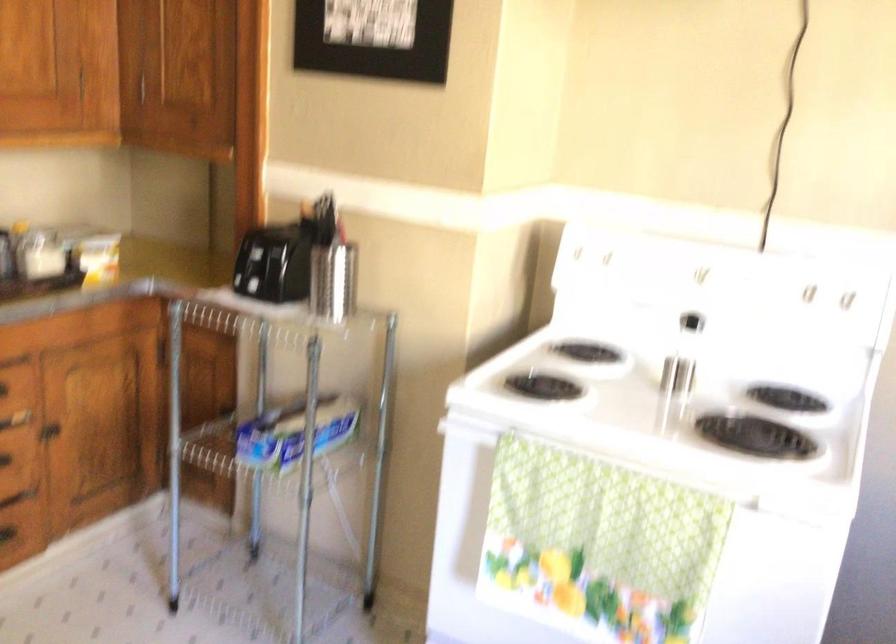
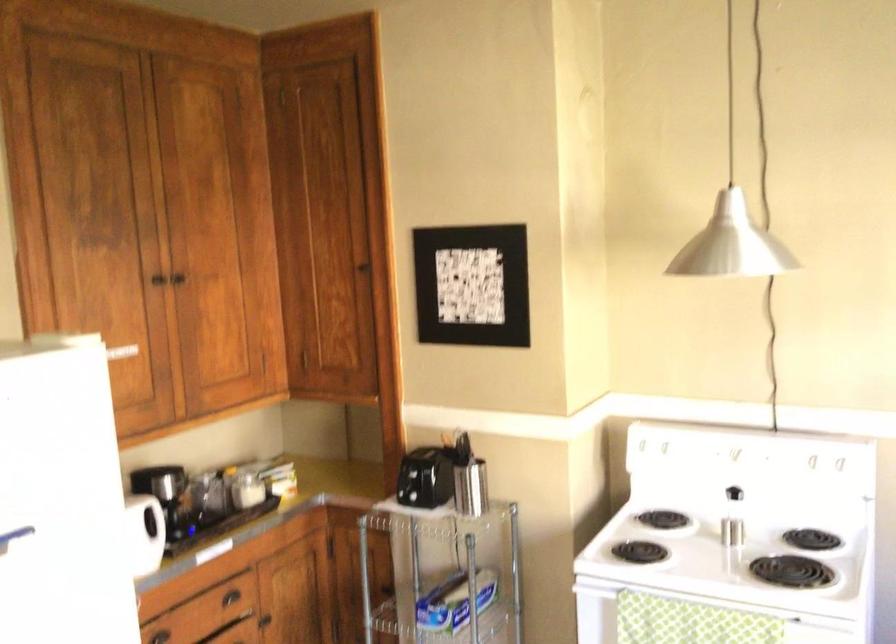
Question: How did the camera likely rotate?

Choices:
 (A) Left
 (B) Right
 (C) Up
 (D) Down

Answer: (C)